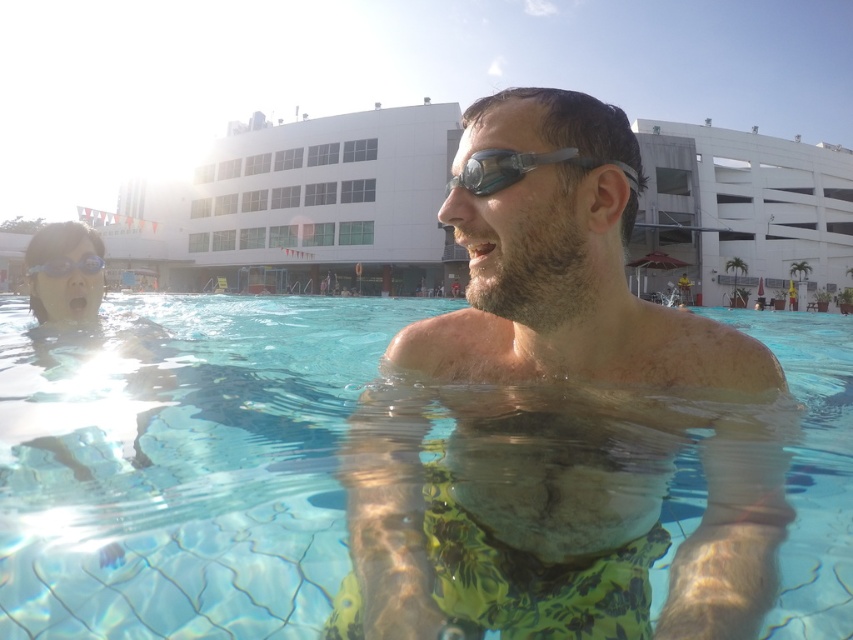
Is point (502, 161) in front of point (61, 260)?

Yes, point (502, 161) is in front of point (61, 260).

Measure the distance between transparent silicone goggles at center and transparent plastic goggles at upper center.

The distance of transparent silicone goggles at center from transparent plastic goggles at upper center is 2.02 meters.

Identify the location of transparent silicone goggles at center. (508, 168).

I want to click on transparent silicone goggles at center, so click(508, 168).

Is green floral shorts at center to the right of transparent silicone goggles at center from the viewer's perspective?

Indeed, green floral shorts at center is positioned on the right side of transparent silicone goggles at center.

Can you confirm if green floral shorts at center is bigger than transparent silicone goggles at center?

Yes, green floral shorts at center is bigger than transparent silicone goggles at center.

Is point (422, 534) positioned in front of point (521, 152)?

That is True.

Find the location of a particular element. green floral shorts at center is located at coordinates (564, 268).

Is transparent plastic water at center in front of transparent silicone goggles at center?

That is True.

Between transparent plastic water at center and transparent silicone goggles at center, which one appears on the left side from the viewer's perspective?

transparent silicone goggles at center

This screenshot has height=640, width=853. What do you see at coordinates (404, 484) in the screenshot?
I see `transparent plastic water at center` at bounding box center [404, 484].

Find the location of a particular element. transparent plastic water at center is located at coordinates (404, 484).